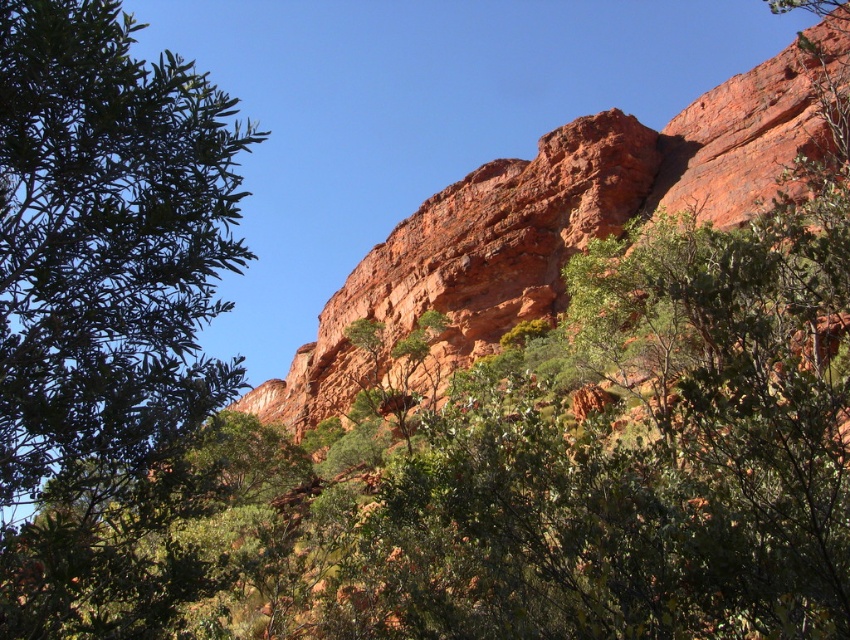
Does green leafy tree at left lie in front of reddish-brown rock at upper center?

Yes.

The width and height of the screenshot is (850, 640). Find the location of `green leafy tree at left`. green leafy tree at left is located at coordinates (106, 243).